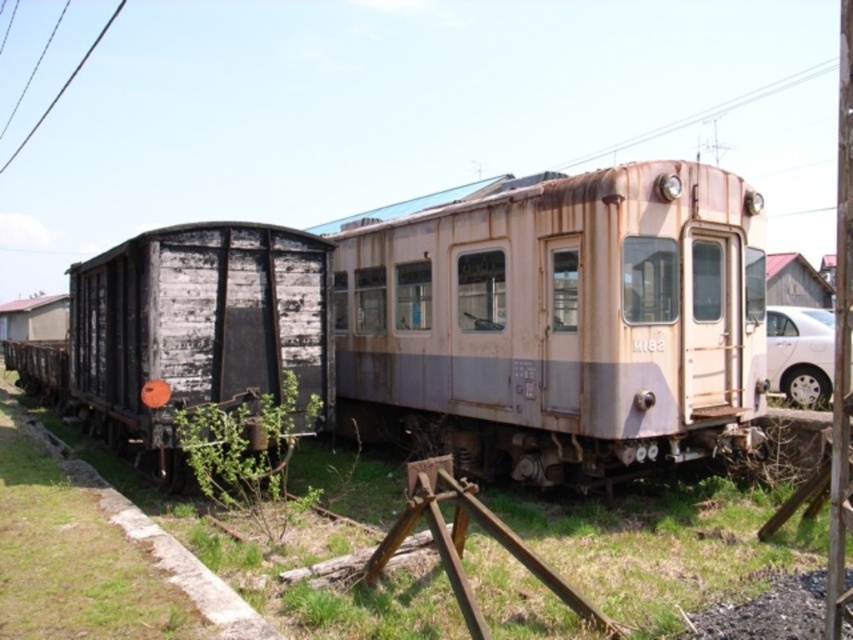
Question: Which point is farther to the camera?

Choices:
 (A) (109, 24)
 (B) (817, 342)
 (C) (109, 308)
 (D) (735, 218)

Answer: (A)

Question: Can you confirm if weathered wood wagon at left is positioned above black wire at upper left?

Choices:
 (A) yes
 (B) no

Answer: (B)

Question: Which point is closer to the camera?

Choices:
 (A) (281, 305)
 (B) (566, 445)
 (C) (90, 45)
 (D) (804, 324)

Answer: (B)

Question: Is rusty metal train at center smaller than white matte car at right?

Choices:
 (A) no
 (B) yes

Answer: (A)

Question: Can you confirm if white matte car at right is smaller than black wire at upper left?

Choices:
 (A) no
 (B) yes

Answer: (B)

Question: Which is nearer to the black wire at upper left?

Choices:
 (A) weathered wood wagon at left
 (B) white matte car at right

Answer: (A)